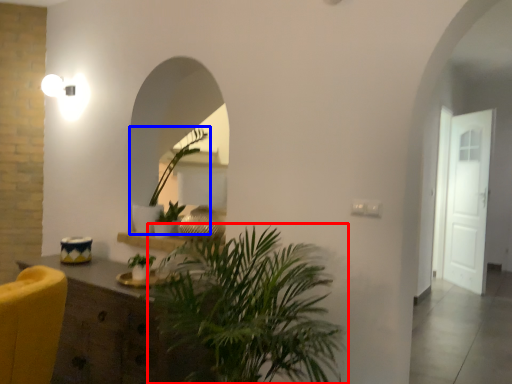
Question: Among these objects, which one is nearest to the camera, houseplant (highlighted by a red box) or houseplant (highlighted by a blue box)?

Choices:
 (A) houseplant
 (B) houseplant

Answer: (A)